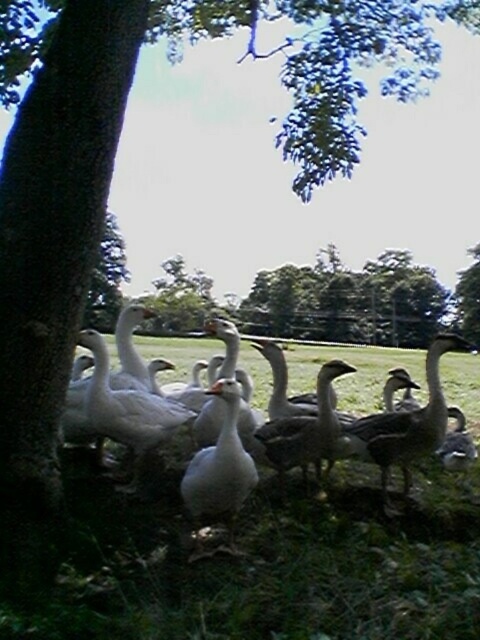
You are a wildlife photographer aiming to capture a photo of the white feathered goose at left and the gray matte duck at center. Which animal should you focus on first if you want to photograph the larger one?

The white feathered goose at left is bigger than the gray matte duck at center, so you should focus on the white feathered goose at left first to photograph the larger one.

You are a photographer trying to capture a shot of the white feathered goose at left and the gray matte duck at center. Since you want both subjects in the frame, which direction should you move your camera to ensure both are visible?

Since the white feathered goose at left is to the left of the gray matte duck at center, you should position your camera so that it can capture both the left side and center areas of the scene. Moving the camera slightly to the right might help include both subjects in the frame.